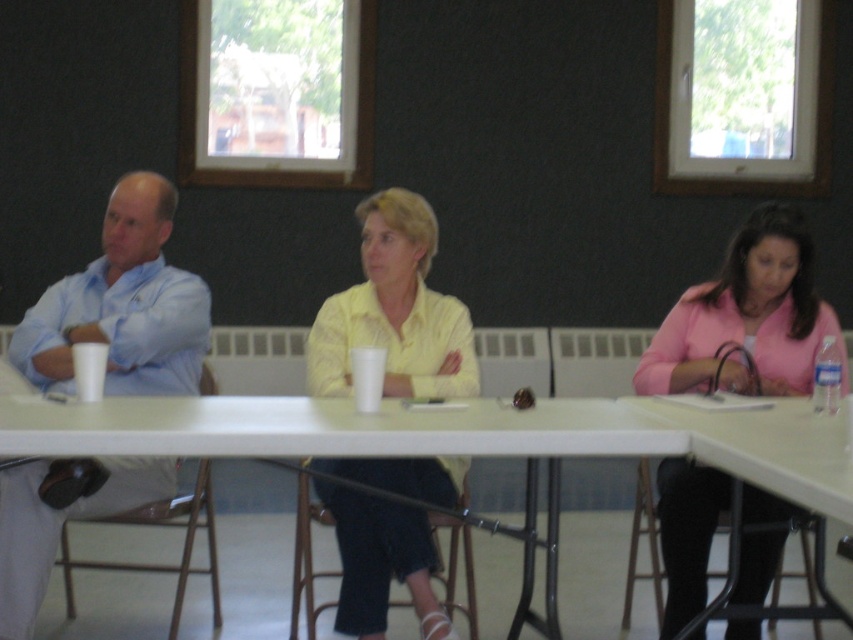
You are a service robot in a meeting room. You need to deliver a document to both the yellow matte shirt at center and the light blue shirt at left. The document requires that you place it within 20 inches of each person. Can you place the document between them?

The yellow matte shirt at center and light blue shirt at left are 25.67 inches apart from each other. Since the required distance is 20 inches for each, the 25.67 inches gap is wider than needed. Therefore, placing the document between them would satisfy the 20 inches requirement for both.

You are a photographer standing behind the table in the meeting room. You want to take a photo of both the yellow matte shirt at center and the light blue shirt at left so that both are fully visible. Which person should you position closer to the camera to ensure the shorter one isn

The light blue shirt at left is shorter than the yellow matte shirt at center. To ensure both are fully visible, position the light blue shirt at left closer to the camera.

You are a server in a meeting room and need to place a new cup for the person wearing the yellow matte shirt at center. Where should you place the cup in relation to the white plastic table at center?

The yellow matte shirt at center is located above the white plastic table at center, so you should place the cup on the white plastic table at center directly below the yellow matte shirt at center.